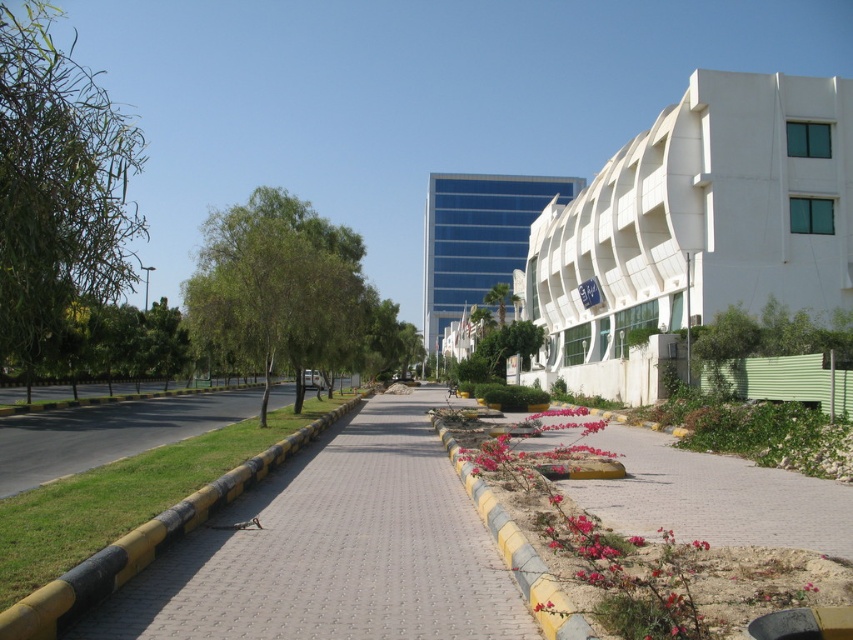
Question: Can you confirm if yellow rubber at lower left is positioned to the right of yellow rubber curb at center?

Choices:
 (A) no
 (B) yes

Answer: (A)

Question: Does white smooth building at right appear under blue glass building at center?

Choices:
 (A) no
 (B) yes

Answer: (B)

Question: Is blue glass building at center closer to the viewer compared to yellow rubber curb at center?

Choices:
 (A) yes
 (B) no

Answer: (B)

Question: Among these objects, which one is farthest from the camera?

Choices:
 (A) yellow rubber curb at center
 (B) blue glass building at center
 (C) white smooth building at right
 (D) yellow rubber at lower left

Answer: (B)

Question: Among these objects, which one is farthest from the camera?

Choices:
 (A) yellow rubber at lower left
 (B) blue glass building at center

Answer: (B)

Question: Estimate the real-world distances between objects in this image. Which object is farther from the blue glass building at center?

Choices:
 (A) yellow rubber curb at center
 (B) yellow rubber at lower left
 (C) white smooth building at right

Answer: (A)